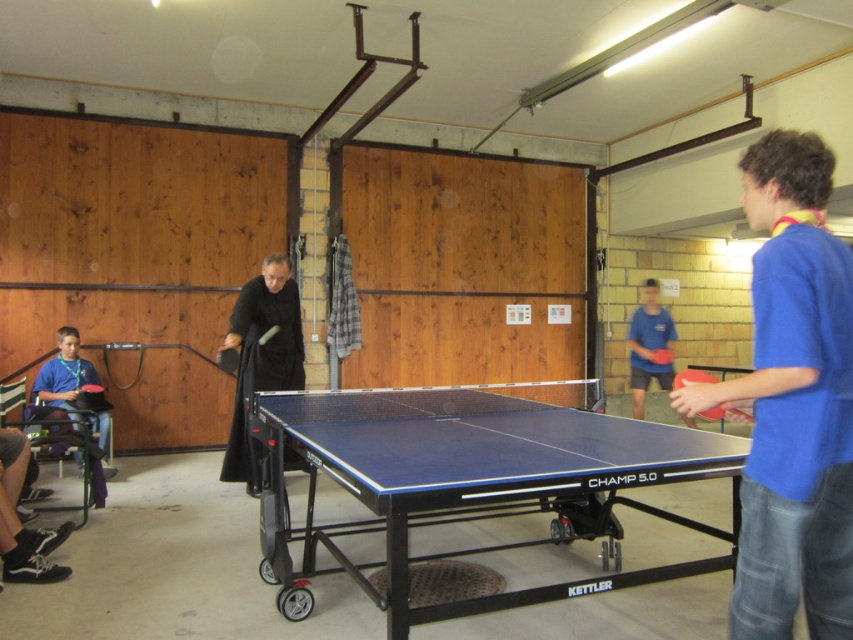
You are a table tennis player standing at point (664, 362) and want to move to the back of the table. Can you reach point (671, 371) without crossing the table?

Yes, because point (671, 371) is behind point (664, 362) according to the spatial description.

You are a photographer standing in the gymnasium. You need to capture a photo of both the blue cotton shirt at right and the blue matte table tennis table at center. Which object should you focus on first if you want to include both in the frame without moving the camera?

You should focus on the blue cotton shirt at right first because it is taller than the blue matte table tennis table at center, so you can adjust the camera angle to include both by centering on the taller object.